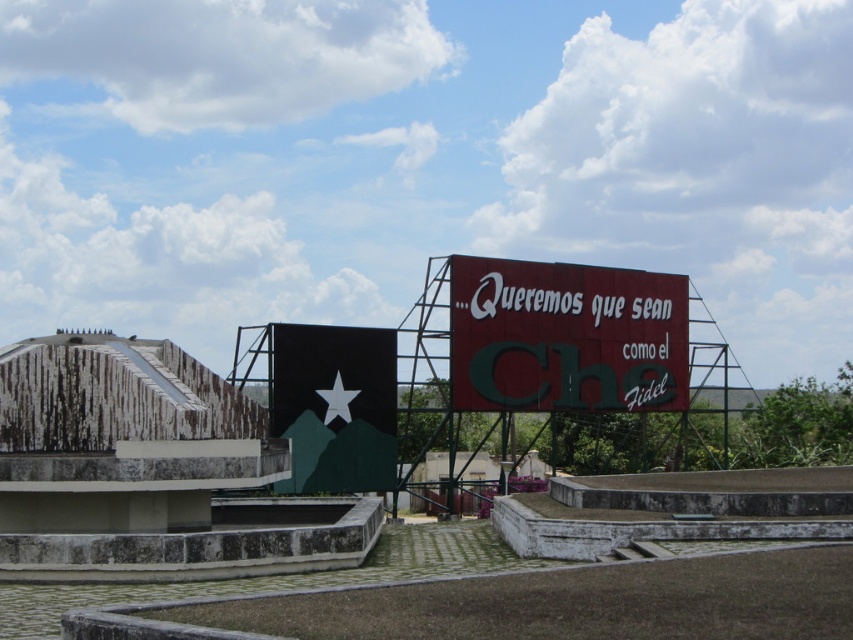
Question: Which of the following is the closest to the observer?

Choices:
 (A) red matte sign at upper right
 (B) black matte sign at center
 (C) green concrete sign at upper center

Answer: (C)

Question: Is red matte sign at upper right to the right of black matte sign at center from the viewer's perspective?

Choices:
 (A) no
 (B) yes

Answer: (B)

Question: Which object appears farthest from the camera in this image?

Choices:
 (A) black matte sign at center
 (B) green concrete sign at upper center
 (C) red matte sign at upper right

Answer: (C)

Question: Observing the image, what is the correct spatial positioning of green concrete sign at upper center in reference to red matte sign at upper right?

Choices:
 (A) below
 (B) above

Answer: (A)

Question: Can you confirm if green concrete sign at upper center is smaller than black matte sign at center?

Choices:
 (A) no
 (B) yes

Answer: (A)

Question: Among these objects, which one is farthest from the camera?

Choices:
 (A) green concrete sign at upper center
 (B) red matte sign at upper right

Answer: (B)